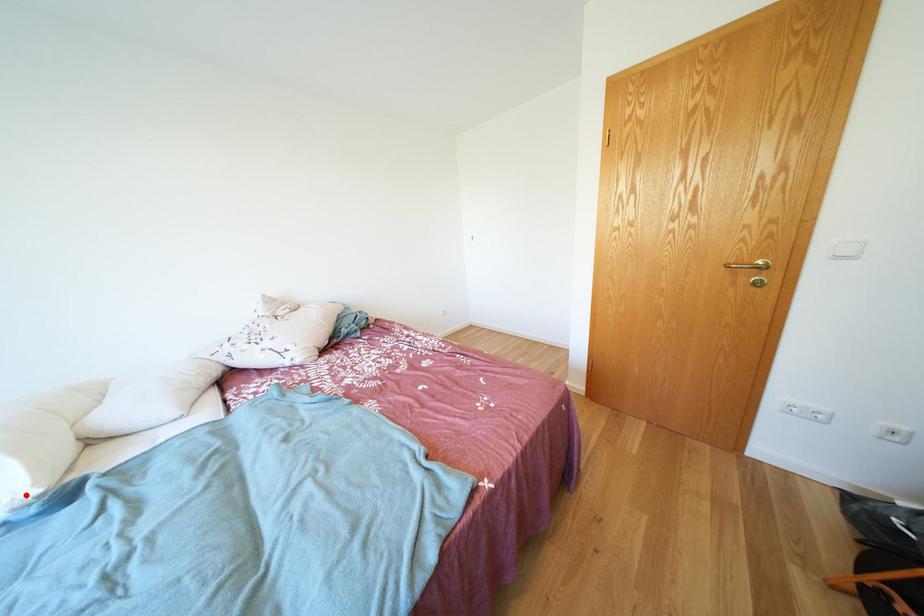
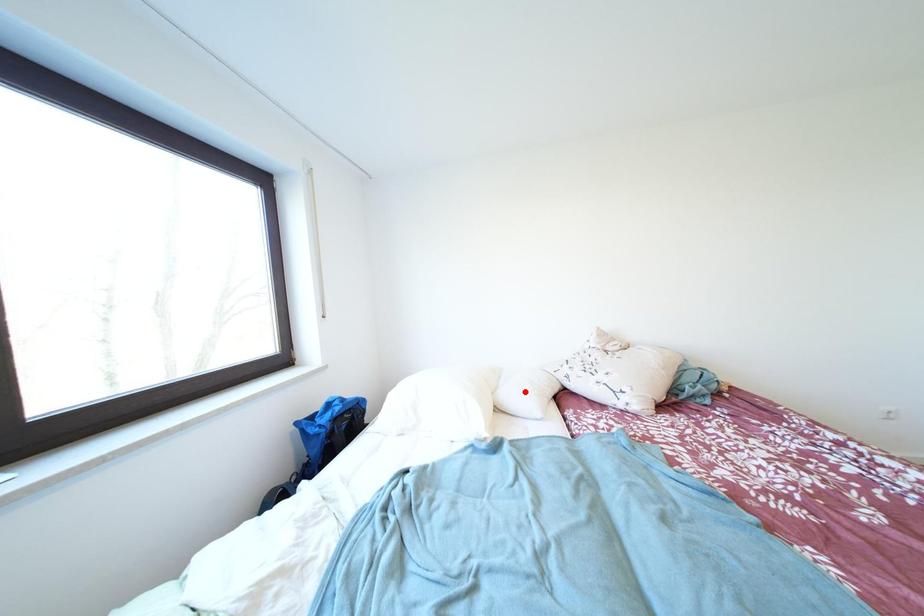
I am providing you with two images of the same scene from different viewpoints. A red point is marked on the first image and another point is marked on the second image. Is the marked point in image1 the same physical position as the marked point in image2?

No